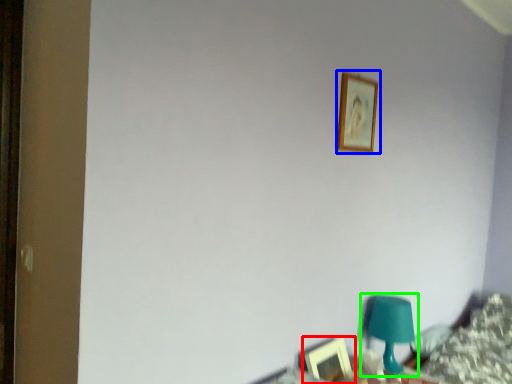
Question: Which object is the closest to the picture frame (highlighted by a red box)? Choose among these: picture frame (highlighted by a blue box) or table lamp (highlighted by a green box).

Choices:
 (A) picture frame
 (B) table lamp

Answer: (B)